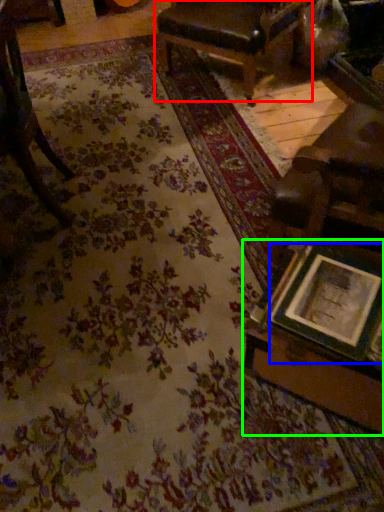
Question: Which object is positioned farthest from chair (highlighted by a red box)? Select from picture frame (highlighted by a blue box) and table (highlighted by a green box).

Choices:
 (A) picture frame
 (B) table

Answer: (A)